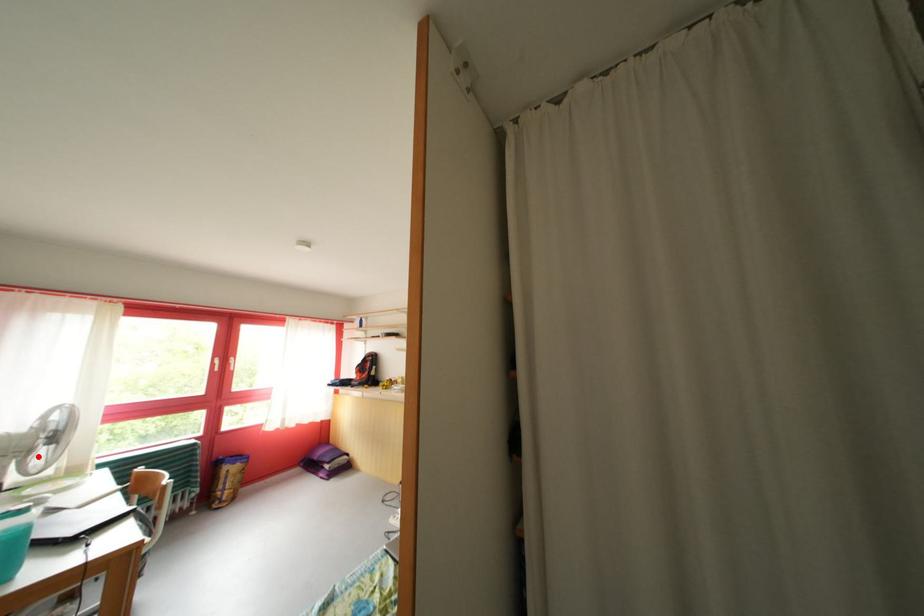
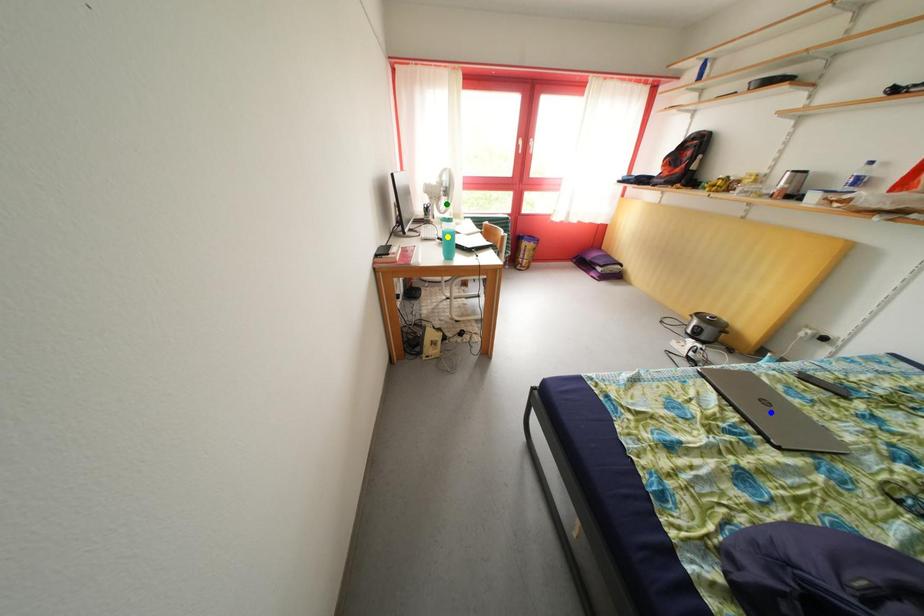
Question: I am providing you with two images of the same scene from different viewpoints. A red point is marked on the first image. You are given multiple points on the second image. Which mark in image 2 goes with the point in image 1?

Choices:
 (A) blue point
 (B) green point
 (C) yellow point

Answer: (B)